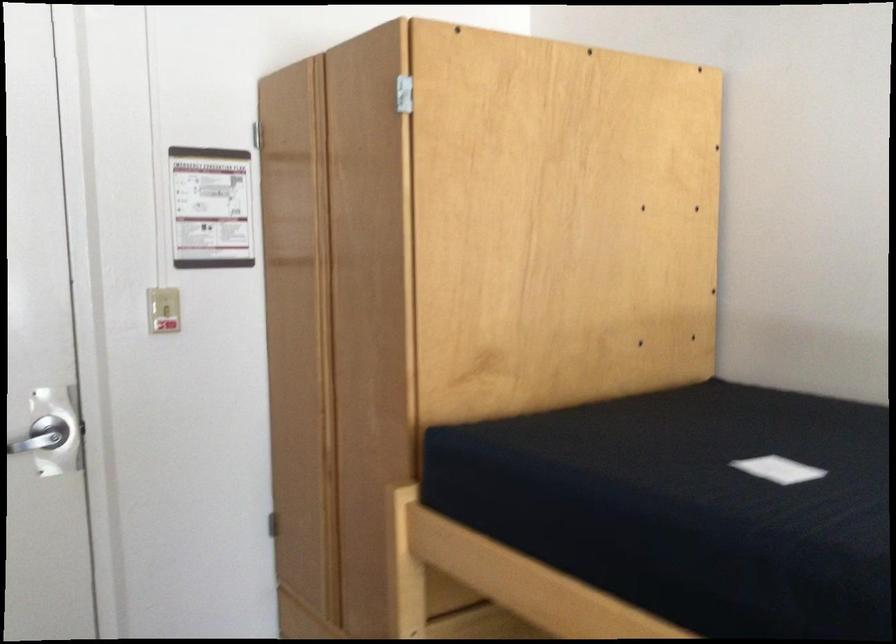
The location [778,469] corresponds to which object?

It corresponds to the white paper tag in the image.